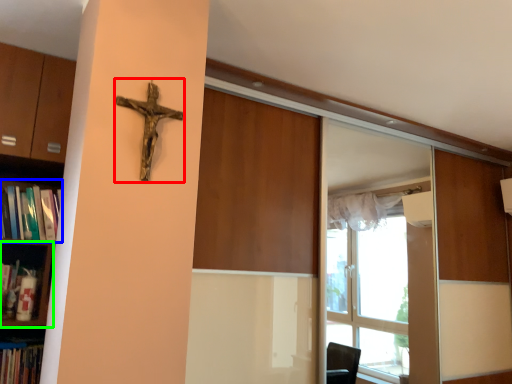
Question: Which is farther away from crucifix (highlighted by a red box)? book (highlighted by a blue box) or shelf (highlighted by a green box)?

Choices:
 (A) book
 (B) shelf

Answer: (B)